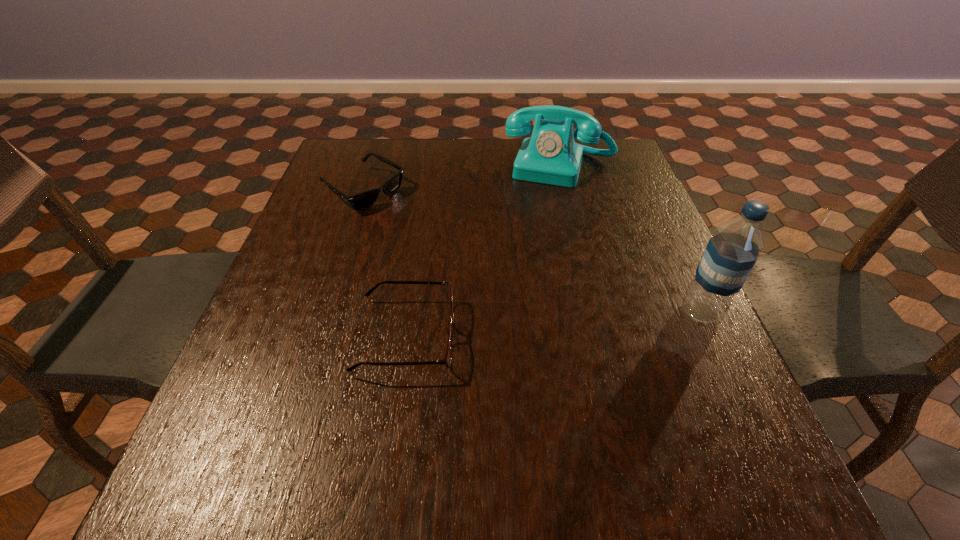
Identify the location of vacant space located 0.160m on the front-facing side of the sunglasses. The width and height of the screenshot is (960, 540). (433, 234).

Locate an element on the screen. This screenshot has width=960, height=540. vacant space located on the front-facing side of the sunglasses is located at coordinates (499, 274).

Locate an element on the screen. The width and height of the screenshot is (960, 540). free location located 0.050m on the front-facing side of the sunglasses is located at coordinates (403, 215).

The image size is (960, 540). What are the coordinates of `free location located 0.110m on the dial of the telephone` in the screenshot? It's located at (542, 211).

Find the location of `vacant space located on the dial of the telephone`. vacant space located on the dial of the telephone is located at coordinates (538, 227).

Where is `vacant space situated on the dial of the telephone`? vacant space situated on the dial of the telephone is located at coordinates (521, 282).

You are a GUI agent. You are given a task and a screenshot of the screen. Output one action in this format:
    pyautogui.click(x=<x>, y=<y>)
    Task: Click on the sunglasses that is at the far edge
    This screenshot has height=540, width=960.
    Given the screenshot: What is the action you would take?
    pyautogui.click(x=363, y=200)

The width and height of the screenshot is (960, 540). In order to click on telephone that is positioned at the far edge in this screenshot , I will do `click(550, 156)`.

The image size is (960, 540). In order to click on object located at the left edge in this screenshot , I will do point(363,200).

The height and width of the screenshot is (540, 960). I want to click on water bottle that is at the right edge, so click(x=731, y=253).